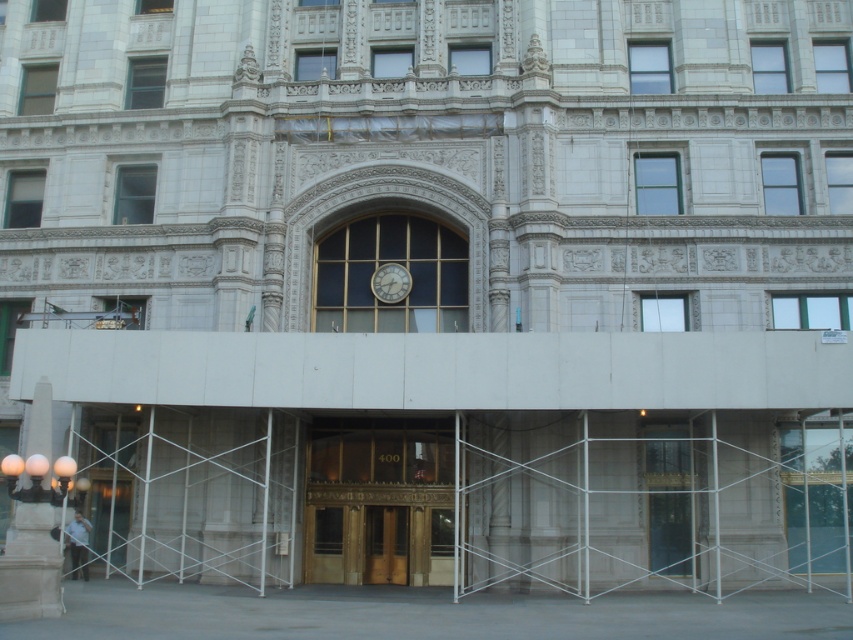
Measure the distance between point (432, 508) and camera.

Point (432, 508) and camera are 53.90 meters apart.

Does gold/golden/bronze door at center have a greater width compared to white marble column at lower left?

Incorrect, gold/golden/bronze door at center's width does not surpass white marble column at lower left's.

Where is `gold/golden/bronze door at center`? gold/golden/bronze door at center is located at coordinates (380, 500).

Is gold/golden/bronze door at center bigger than wooden door at center?

Indeed, gold/golden/bronze door at center has a larger size compared to wooden door at center.

Is point (427, 458) more distant than point (404, 561)?

Yes.

This screenshot has width=853, height=640. I want to click on gold/golden/bronze door at center, so pos(380,500).

Is the position of gold/golden/bronze door at center less distant than that of white glossy clock at center?

Yes, it is in front of white glossy clock at center.

Which is behind, point (347, 449) or point (403, 278)?

The point (403, 278) is behind.

The height and width of the screenshot is (640, 853). Identify the location of gold/golden/bronze door at center. (380, 500).